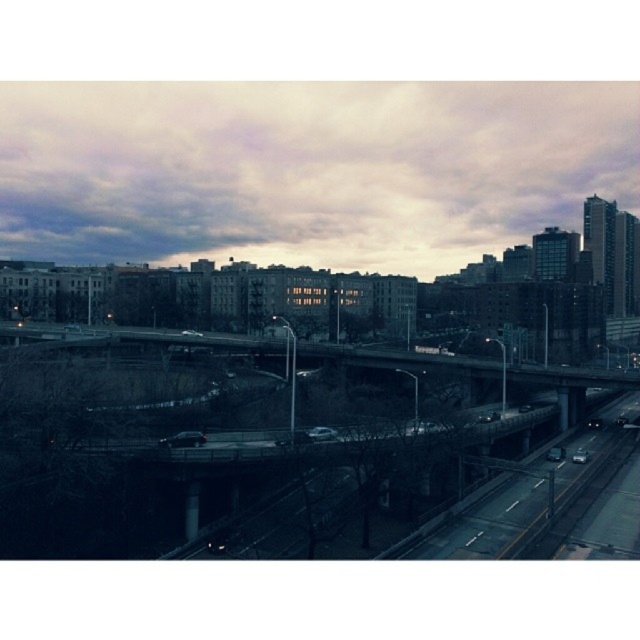
Does cloudy sky at upper center have a lesser height compared to concrete bridge at lower left?

No.

Does point (243, 132) lie behind point (618, 371)?

Yes, it is behind point (618, 371).

Locate an element on the screen. cloudy sky at upper center is located at coordinates (307, 170).

Can you confirm if concrete bridge at center is taller than cloudy sky at upper center?

Indeed, concrete bridge at center has a greater height compared to cloudy sky at upper center.

Between concrete bridge at center and cloudy sky at upper center, which one has less height?

With less height is cloudy sky at upper center.

Is point (394, 100) positioned behind point (525, 144)?

That is False.

In order to click on concrete bridge at center in this screenshot , I will do `click(253, 400)`.

Does concrete bridge at center have a smaller size compared to concrete bridge at lower left?

No.

Is concrete bridge at center taller than concrete bridge at lower left?

Yes, concrete bridge at center is taller than concrete bridge at lower left.

This screenshot has height=640, width=640. What are the coordinates of `concrete bridge at center` in the screenshot? It's located at (253, 400).